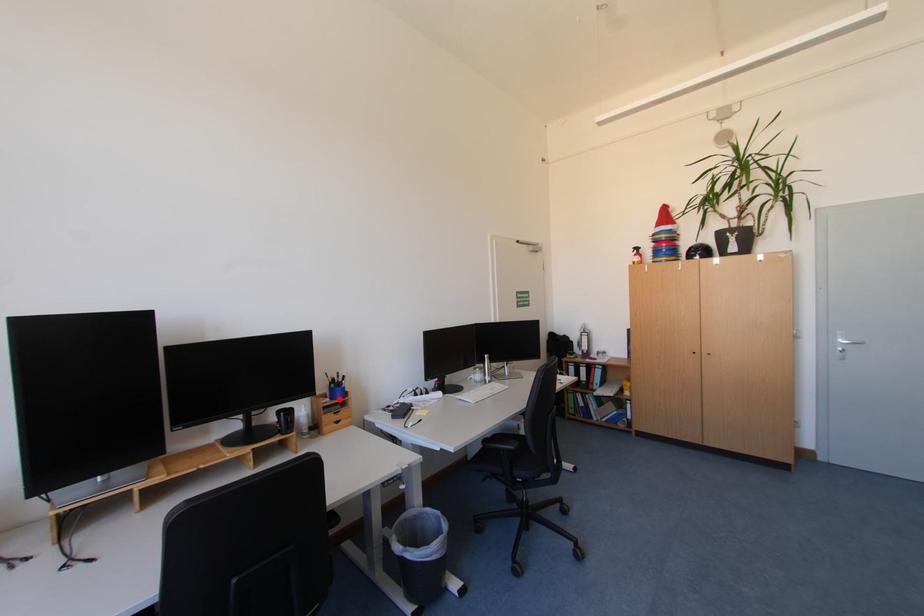
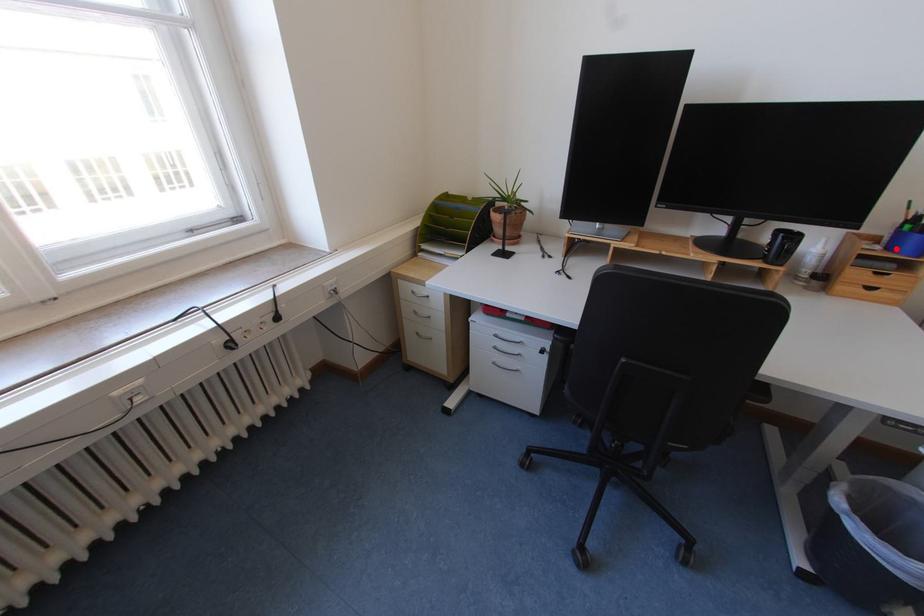
I am providing you with two images of the same scene from different viewpoints. A red point is marked on the first image and another point is marked on the second image. Do the highlighted points in image1 and image2 indicate the same real-world spot?

Yes